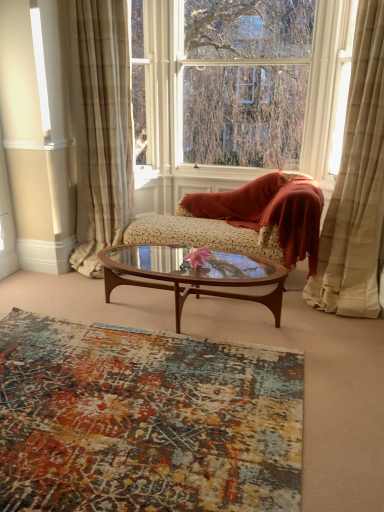
Question: From the image's perspective, relative to velvet floral-patterned chaise lounge at center, is beige textured curtain at right, acting as the second curtain starting from the left, above or below?

Choices:
 (A) above
 (B) below

Answer: (A)

Question: Is beige textured curtain at right, which is the first curtain in right-to-left order, taller or shorter than velvet floral-patterned chaise lounge at center?

Choices:
 (A) short
 (B) tall

Answer: (B)

Question: Which of these objects is positioned closest to the beige plaid curtain at left, which is the second curtain from right to left?

Choices:
 (A) brown wood/glass coffee table at center
 (B) velvet floral-patterned chaise lounge at center
 (C) textured multicolored rug at lower center
 (D) beige textured curtain at right, acting as the second curtain starting from the left
 (E) clear glass window at upper center

Answer: (E)

Question: Considering the real-world distances, which object is closest to the textured multicolored rug at lower center?

Choices:
 (A) clear glass window at upper center
 (B) brown wood/glass coffee table at center
 (C) beige plaid curtain at left, the first curtain from the left
 (D) velvet floral-patterned chaise lounge at center
 (E) beige textured curtain at right, which is the first curtain in right-to-left order

Answer: (B)